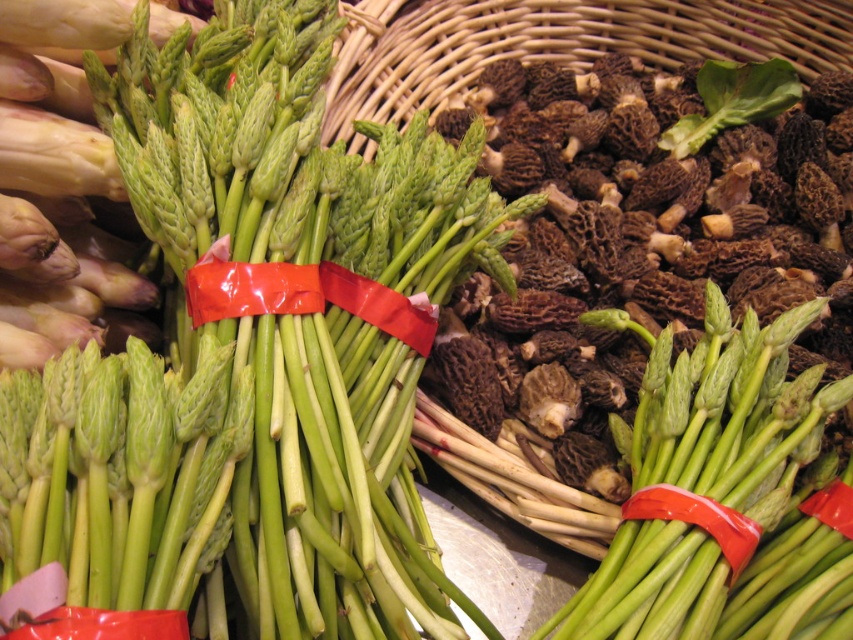
Image resolution: width=853 pixels, height=640 pixels. What do you see at coordinates (303, 296) in the screenshot? I see `red plastic ribbon at center` at bounding box center [303, 296].

Measure the distance between red plastic ribbon at center and red rubber band at center.

They are 13.39 inches apart.

The image size is (853, 640). Describe the element at coordinates (303, 296) in the screenshot. I see `red plastic ribbon at center` at that location.

Identify the location of red plastic ribbon at center. Image resolution: width=853 pixels, height=640 pixels. (303, 296).